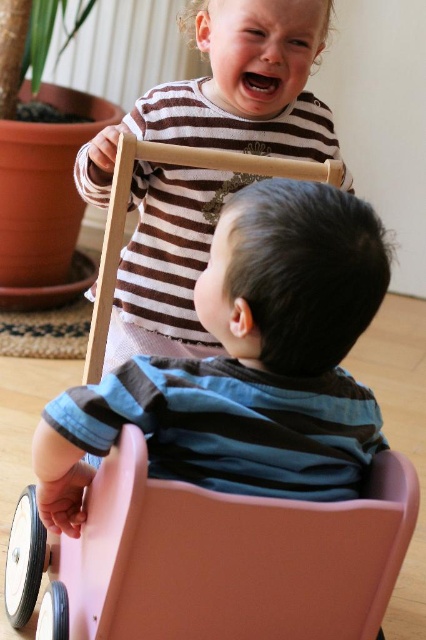
Question: Is matte pink plastic chair at center positioned in front of striped cotton shirt at upper center?

Choices:
 (A) no
 (B) yes

Answer: (B)

Question: Can you confirm if matte pink plastic chair at center is positioned above striped cotton shirt at upper center?

Choices:
 (A) no
 (B) yes

Answer: (A)

Question: Which of the following is the farthest from the observer?

Choices:
 (A) striped cotton shirt at upper center
 (B) matte pink plastic chair at center

Answer: (A)

Question: Can you confirm if matte pink plastic chair at center is positioned below striped cotton shirt at upper center?

Choices:
 (A) no
 (B) yes

Answer: (B)

Question: Among these points, which one is farthest from the camera?

Choices:
 (A) (370, 250)
 (B) (253, 29)

Answer: (B)